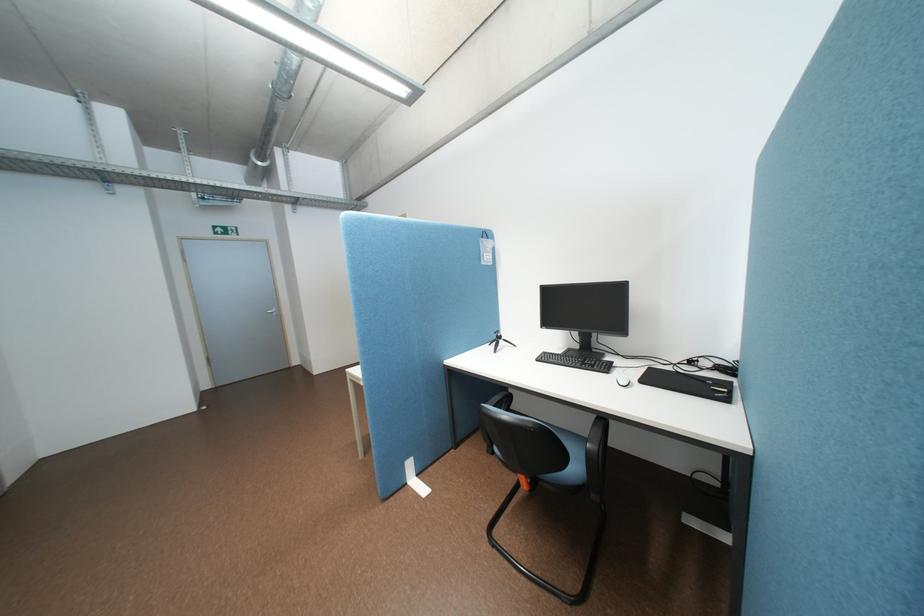
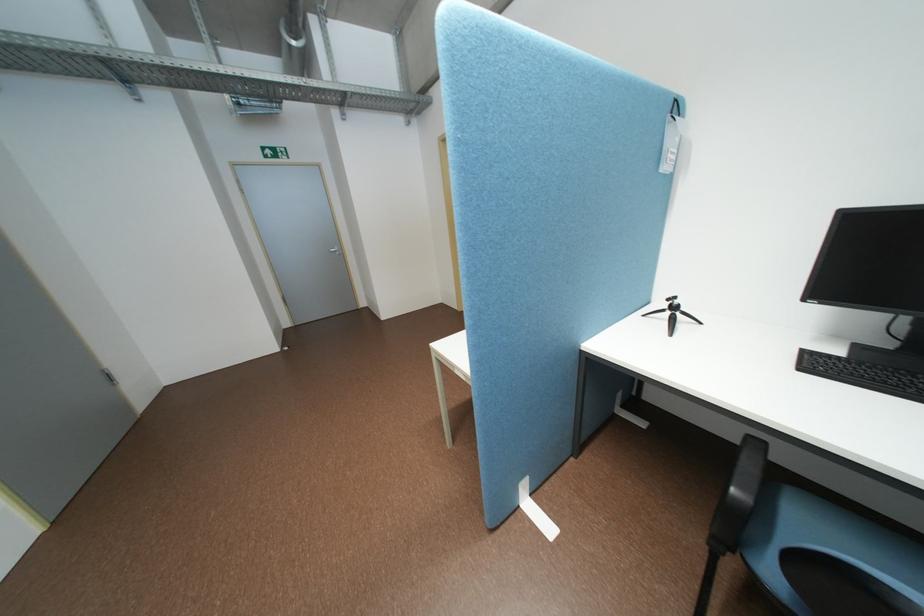
Question: Based on the continuous images, in which direction is the camera rotating? Reply with the corresponding letter.

Choices:
 (A) Left
 (B) Right
 (C) Up
 (D) Down

Answer: (D)